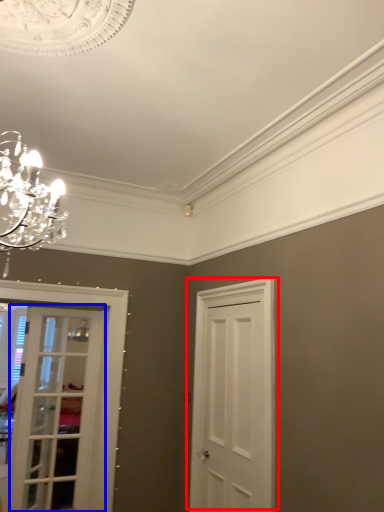
Question: Which point is closer to the camera, door (highlighted by a red box) or door (highlighted by a blue box)?

Choices:
 (A) door
 (B) door

Answer: (A)